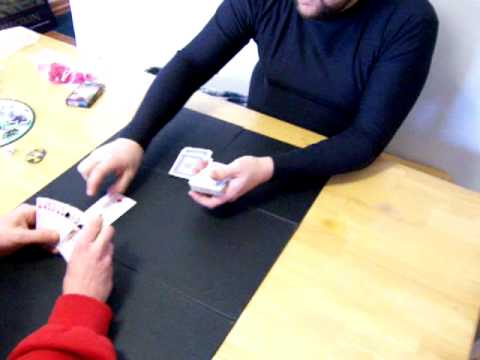
Show me all visible shadow of chair on wall behind it in the image. Your answer should be formatted as a list of tuples, i.e. [(x1, y1), (x2, y2), ...], where each tuple contains the x and y coordinates of a point satisfying the conditions above.

[(443, 116)]